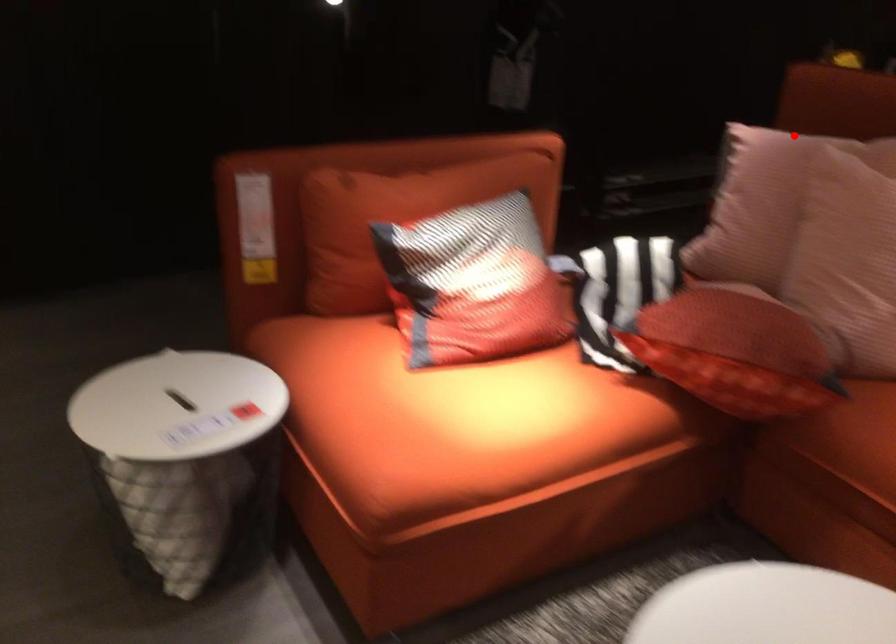
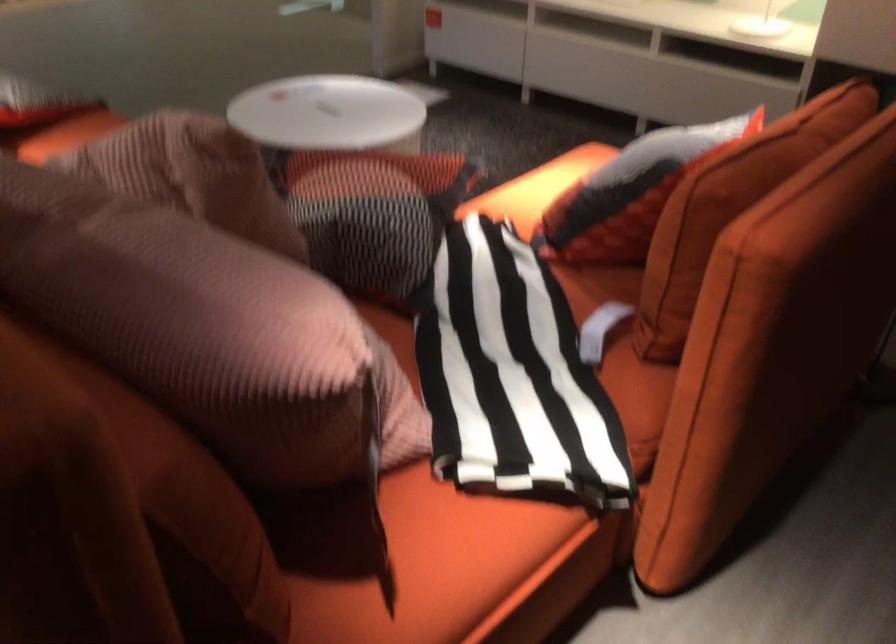
Question: I am providing you with two images of the same scene from different viewpoints. A red point is shown in image1. For the corresponding object point in image2, is it positioned nearer or farther from the camera?

Choices:
 (A) Nearer
 (B) Farther

Answer: (A)